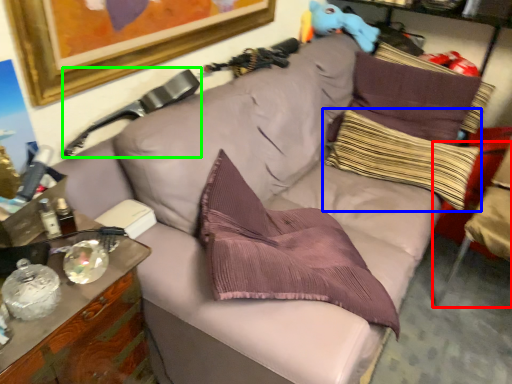
Question: Estimate the real-world distances between objects in this image. Which object is farther from swivel chair (highlighted by a red box), pillow (highlighted by a blue box) or swivel chair (highlighted by a green box)?

Choices:
 (A) pillow
 (B) swivel chair

Answer: (B)